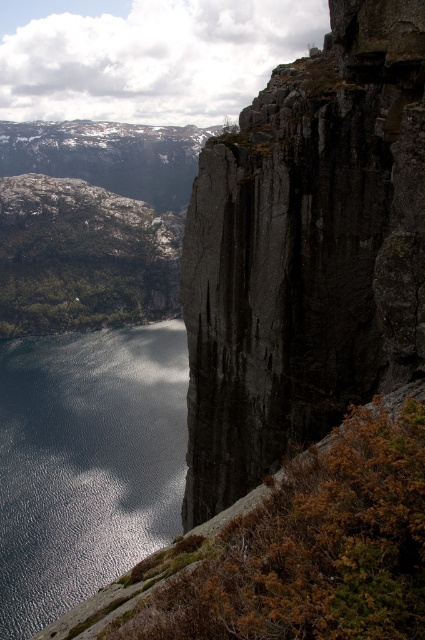
You are a hiker who wants to cross from the cliff to the water. You see the glistening reflective water at lower left and the brown grassy hillside at lower left. Which path is higher? Please answer based on the elevation of the objects.

The glistening reflective water at lower left is positioned over the brown grassy hillside at lower left, so the glistening reflective water at lower left is higher in elevation.

You are a hiker planning to cross from the brown grassy hillside at lower left to the dark gray rock face at upper right. Based on the scene, which area would require more careful navigation and why?

The dark gray rock face at upper right requires more careful navigation because it occupies less space, making it a narrower path compared to the brown grassy hillside at lower left which has more area to move around.

You are a hiker who wants to take a photo of the dark gray rock face at upper right and the brown grassy hillside at lower left. Which object should you focus on first if you want to capture both in a single frame without moving your camera?

You should focus on the dark gray rock face at upper right first because it is much taller than the brown grassy hillside at lower left, so adjusting the focus to the taller object ensures both are in the frame.